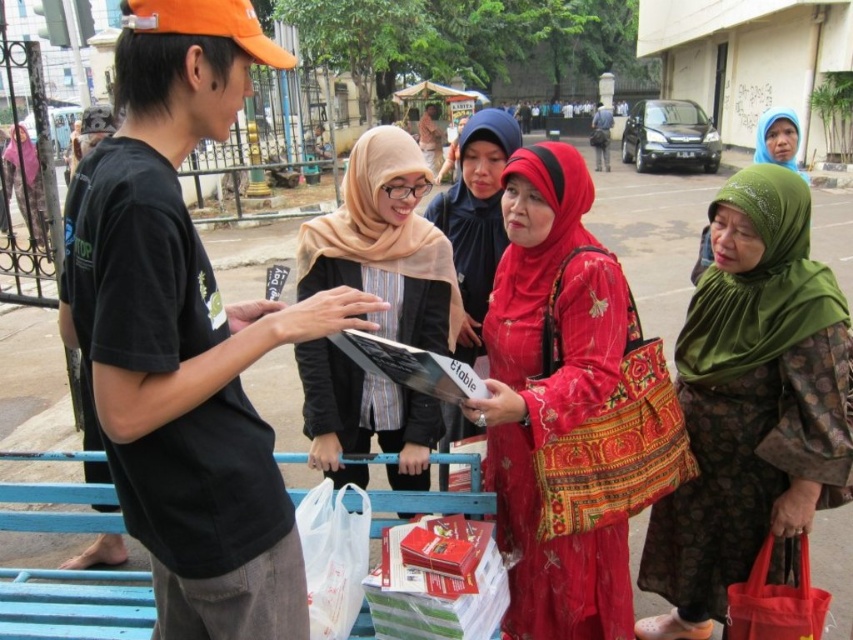
You are a photographer trying to capture a clear shot of the matte beige scarf at center and the green printed dress at right. From your current position, which object would you need to adjust your angle to avoid being blocked by the other?

The matte beige scarf at center is behind the green printed dress at right, so to capture both clearly, you would need to adjust your angle to avoid the green printed dress at right blocking the matte beige scarf at center.

You are a photographer trying to capture a photo of the group. You want to ensure both the green printed dress at right and the matte red dress at center are clearly visible. Which dress should you focus on first to ensure proper exposure, considering their sizes?

The green printed dress at right has a smaller size compared to matte red dress at center. Therefore, you should focus on the matte red dress at center first because it is larger and will require more attention to capture details properly.

You are a photographer aiming to capture a photo of the matte red dress at center and the matte beige scarf at center. Based on their positions, which one should you focus on first if you want to follow the natural left to right reading direction?

The matte beige scarf at center should be focused on first since it is on the left side of the matte red dress at center, following the natural left to right reading direction.